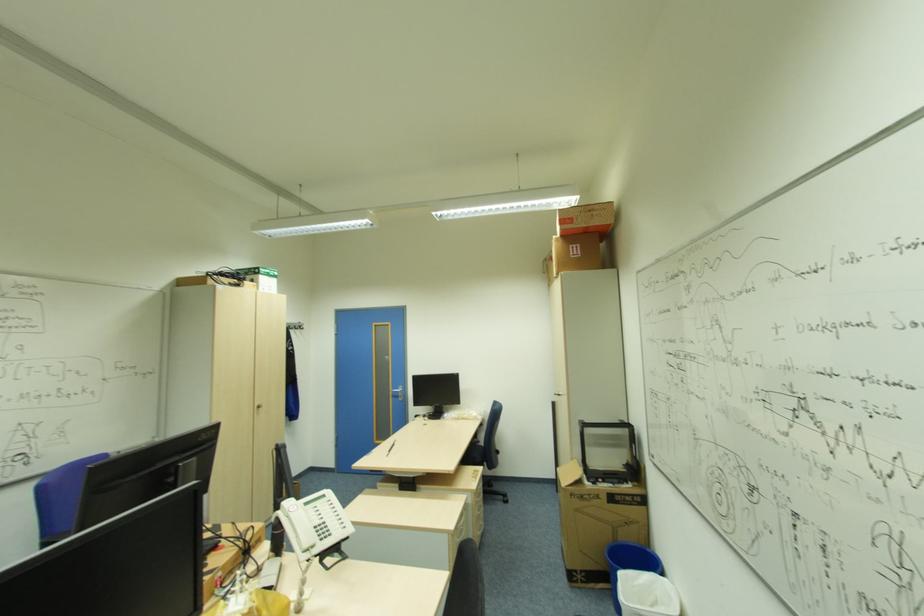
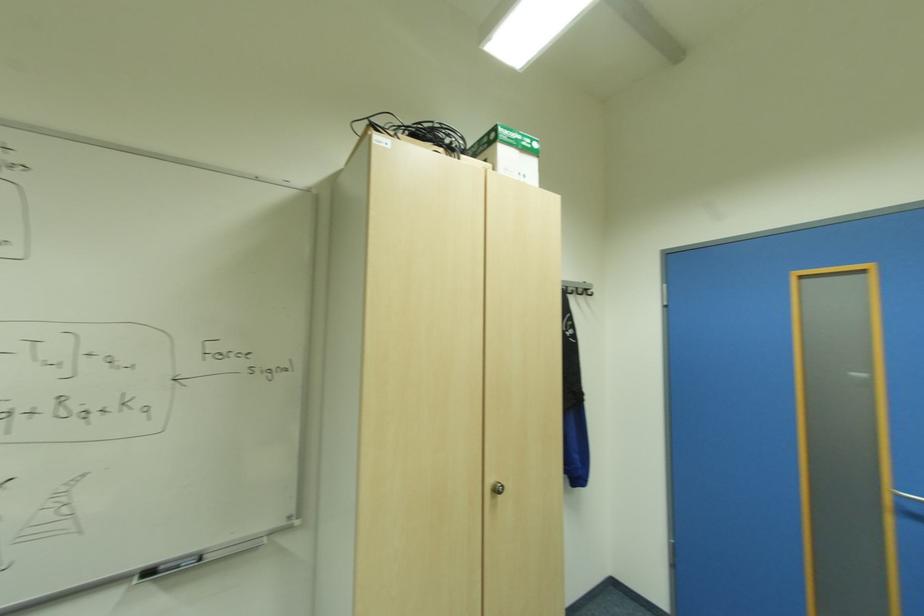
The point at (276, 270) is marked in the first image. Where is the corresponding point in the second image?

(533, 140)